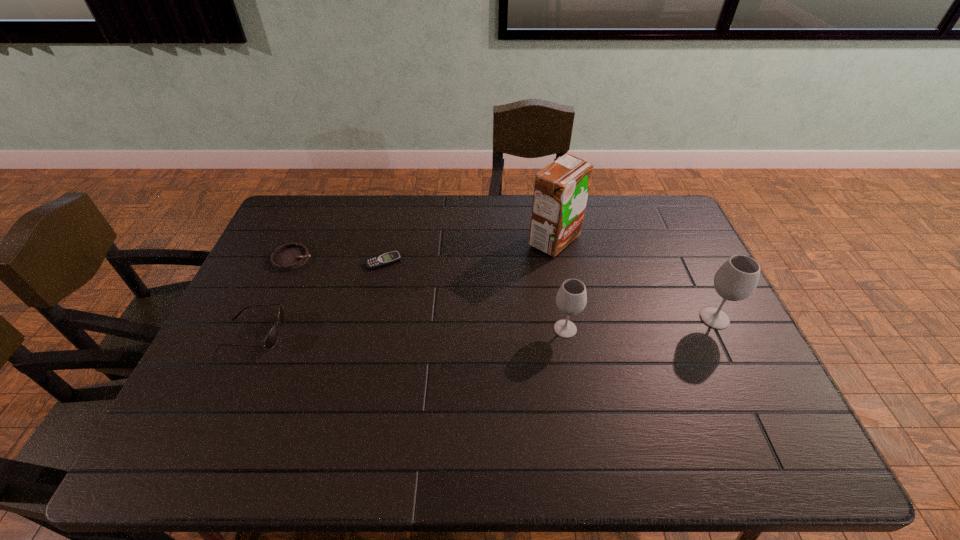
Observe the arrangement of all wineglasss in the image. To keep them evenly spaced, where would you place another wineglass on the left? Please locate a free space. Please provide its 2D coordinates. Your answer should be formatted as a tuple, i.e. [(x, y)], where the tuple contains the x and y coordinates of a point satisfying the conditions above.

[(409, 340)]